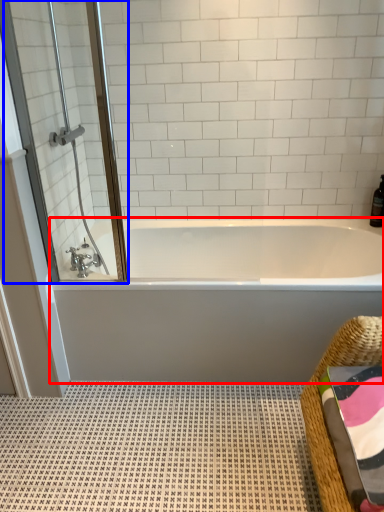
Question: Among these objects, which one is nearest to the camera, bathtub (highlighted by a red box) or screen door (highlighted by a blue box)?

Choices:
 (A) bathtub
 (B) screen door

Answer: (B)